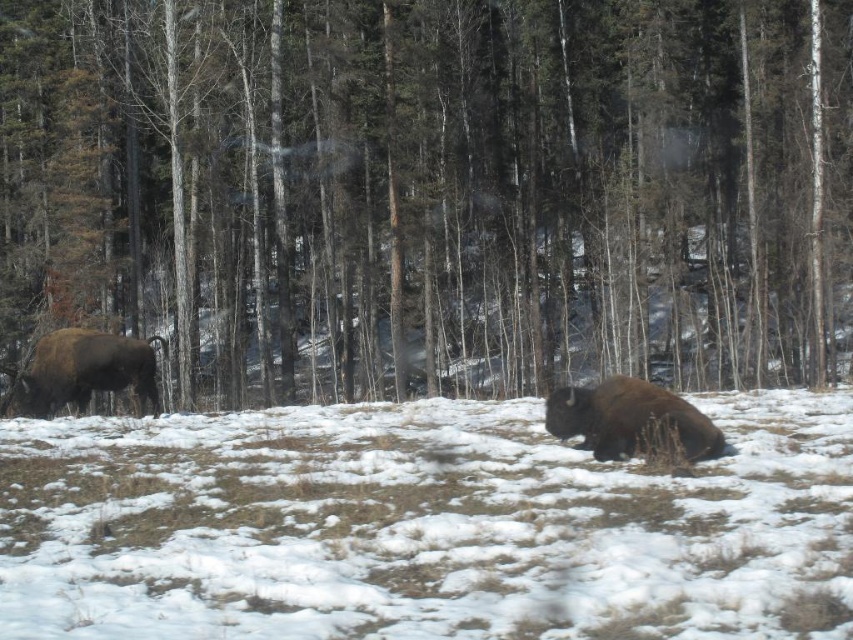
Question: Among these points, which one is farthest from the camera?

Choices:
 (A) (431, 333)
 (B) (57, 385)
 (C) (621, 444)

Answer: (A)

Question: Does brown wood tree at left lie in front of brown furry bison at left?

Choices:
 (A) yes
 (B) no

Answer: (B)

Question: Does white fluffy snow at center appear on the right side of brown furry bison at lower center?

Choices:
 (A) no
 (B) yes

Answer: (A)

Question: Which point appears closest to the camera in this image?

Choices:
 (A) (563, 422)
 (B) (396, 330)
 (C) (38, 371)

Answer: (A)

Question: Which point is farther to the camera?

Choices:
 (A) (109, 362)
 (B) (631, 376)

Answer: (A)

Question: In this image, where is brown wood tree at left located relative to white fluffy snow at center?

Choices:
 (A) below
 (B) above

Answer: (B)